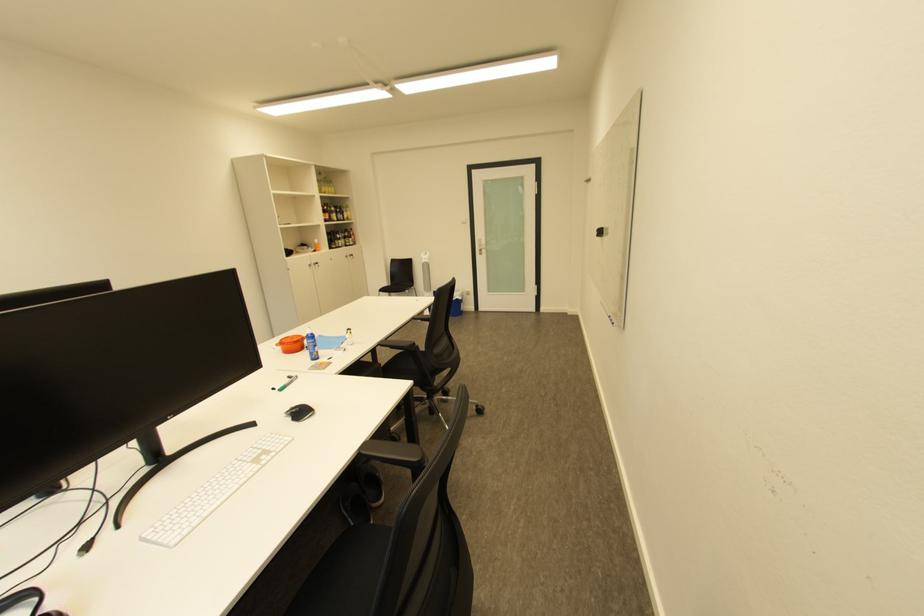
Where would you pull the metal door handle? Please return your answer as a coordinate pair (x, y).

(480, 246)